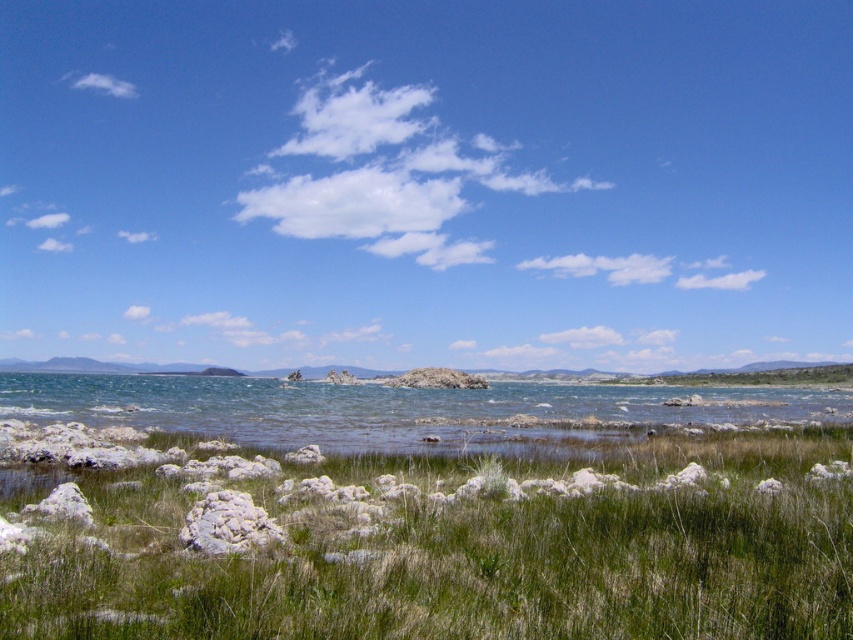
Between green grassy at lower center and clear water at center, which one has more height?

Standing taller between the two is clear water at center.

Is point (427, 481) in front of point (236, 433)?

Yes, point (427, 481) is closer to viewer.

Who is more forward, (405,568) or (590,408)?

Point (405,568) is in front.

The width and height of the screenshot is (853, 640). What are the coordinates of `green grassy at lower center` in the screenshot? It's located at (453, 547).

Is clear water at center shorter than white fluffy cloud at upper left?

Yes, clear water at center is shorter than white fluffy cloud at upper left.

Does point (32, 397) come behind point (90, 72)?

No, (32, 397) is in front of (90, 72).

Locate an element on the screen. clear water at center is located at coordinates (399, 410).

Who is lower down, white rock formation at center or white fluffy cloud at upper left?

white rock formation at center

Between white rock formation at center and white fluffy cloud at upper left, which one appears on the left side from the viewer's perspective?

From the viewer's perspective, white fluffy cloud at upper left appears more on the left side.

Locate an element on the screen. white rock formation at center is located at coordinates (428, 182).